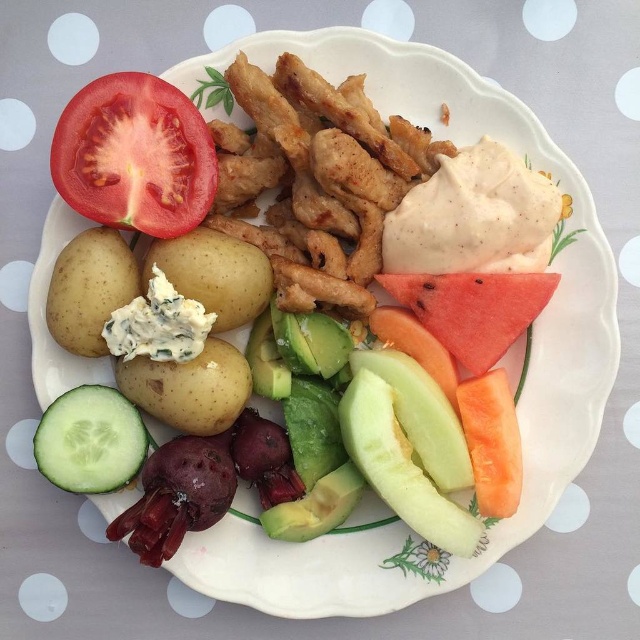
Is smooth yellow potato at lower left closer to the viewer compared to blue cheese potato at center?

Yes, it is in front of blue cheese potato at center.

Is point (84, 250) less distant than point (266, 285)?

Yes, it is in front of point (266, 285).

Identify the location of smooth yellow potato at lower left. (90, 289).

Measure the distance between red matte tomato at upper left and green smooth cucumber at lower left.

13.95 inches

Who is higher up, red matte tomato at upper left or green smooth cucumber at lower left?

red matte tomato at upper left is above.

Is point (180, 156) in front of point (70, 436)?

No, it is not.

The image size is (640, 640). I want to click on red matte tomato at upper left, so click(134, 156).

Who is shorter, red matte tomato at upper left or smooth yellow potato at center-left?

smooth yellow potato at center-left is shorter.

Based on the photo, between red matte tomato at upper left and smooth yellow potato at center-left, which one appears on the left side from the viewer's perspective?

Positioned to the left is red matte tomato at upper left.

Locate an element on the screen. The image size is (640, 640). red matte tomato at upper left is located at coordinates (134, 156).